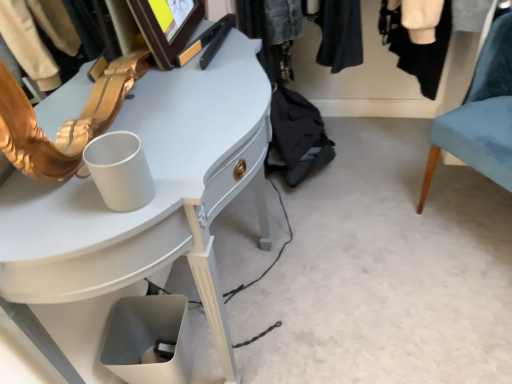
Identify the location of vacant space underneath denim jacket at upper center (from a real-world perspective). This screenshot has width=512, height=384. (385, 162).